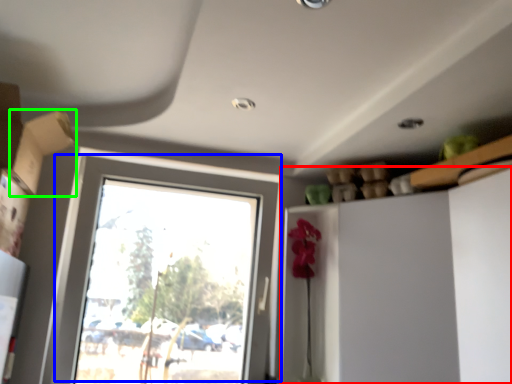
Question: Which object is positioned farthest from dresser (highlighted by a red box)? Select from window (highlighted by a blue box) and cardboard box (highlighted by a green box).

Choices:
 (A) window
 (B) cardboard box

Answer: (B)